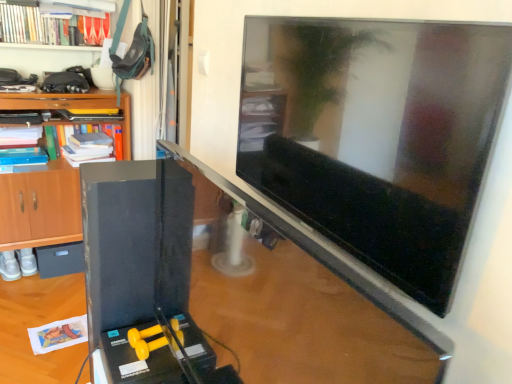
Identify the location of black matte drawer at lower left. (60, 259).

What are the coordinates of `matte black tv at upper right` in the screenshot? It's located at (375, 135).

At what (x,y) coordinates should I click in order to perform the action: click on wooden cabinet at left. Please return your answer as a coordinate pair (x, y). Looking at the image, I should click on (37, 214).

Describe the element at coordinates (32, 25) in the screenshot. I see `hardcover book at upper left, acting as the second book starting from the bottom` at that location.

This screenshot has width=512, height=384. Describe the element at coordinates (93, 145) in the screenshot. I see `green matte book at upper left, which is counted as the 2th book, starting from the top` at that location.

Image resolution: width=512 pixels, height=384 pixels. Find the location of `black matte drawer at lower left`. black matte drawer at lower left is located at coordinates (60, 259).

From the picture: How distant is matte black tv at upper right from black matte drawer at lower left?

matte black tv at upper right and black matte drawer at lower left are 2.16 meters apart from each other.

From a real-world perspective, is matte black tv at upper right positioned over black matte drawer at lower left based on gravity?

Correct, in the physical world, matte black tv at upper right is higher than black matte drawer at lower left.

Does matte black tv at upper right turn towards black matte drawer at lower left?

No, matte black tv at upper right is not facing towards black matte drawer at lower left.

Is satin black monitor at center not within green matte book at upper left, which is counted as the 2th book, starting from the top?

That's correct, satin black monitor at center is outside of green matte book at upper left, which is counted as the 2th book, starting from the top.

Considering the relative positions of satin black monitor at center and green matte book at upper left, which is counted as the 2th book, starting from the top, in the image provided, is satin black monitor at center in front of green matte book at upper left, which is counted as the 2th book, starting from the top,?

Yes, it is in front of green matte book at upper left, which is counted as the 2th book, starting from the top.

Where is `computer desk in front of the green matte book at upper left, which is counted as the 2th book, starting from the top`? The width and height of the screenshot is (512, 384). computer desk in front of the green matte book at upper left, which is counted as the 2th book, starting from the top is located at coordinates (233, 291).

Does point (219, 324) come closer to viewer compared to point (78, 149)?

Yes, it is in front of point (78, 149).

Are matte black tv at upper right and green matte book at upper left, which is counted as the 2th book, starting from the top, located far from each other?

Yes.

Find the location of `the 2nd book behind the matte black tv at upper right`. the 2nd book behind the matte black tv at upper right is located at coordinates (93, 145).

How distant is matte black tv at upper right from green matte book at upper left, acting as the 1th book starting from the bottom?

A distance of 1.85 meters exists between matte black tv at upper right and green matte book at upper left, acting as the 1th book starting from the bottom.

Based on their positions, is matte black tv at upper right located to the left or right of green matte book at upper left, acting as the 1th book starting from the bottom?

matte black tv at upper right is positioned on green matte book at upper left, acting as the 1th book starting from the bottom,'s right side.

Considering the positions of objects hardcover book at upper left, placed as the 1th book when sorted from top to bottom, and wooden cabinet at left in the image provided, who is more to the left, hardcover book at upper left, placed as the 1th book when sorted from top to bottom, or wooden cabinet at left?

From the viewer's perspective, wooden cabinet at left appears more on the left side.

Is hardcover book at upper left, placed as the 1th book when sorted from top to bottom, completely or partially outside of wooden cabinet at left?

Indeed, hardcover book at upper left, placed as the 1th book when sorted from top to bottom, is completely outside wooden cabinet at left.

Is hardcover book at upper left, acting as the second book starting from the bottom, taller than wooden cabinet at left?

No, hardcover book at upper left, acting as the second book starting from the bottom, is not taller than wooden cabinet at left.

Which of these two, hardcover book at upper left, acting as the second book starting from the bottom, or wooden cabinet at left, is thinner?

Thinner between the two is hardcover book at upper left, acting as the second book starting from the bottom.

Is black matte drawer at lower left not close to matte black tv at upper right?

Yes, black matte drawer at lower left and matte black tv at upper right are quite far apart.

What's the angular difference between black matte drawer at lower left and matte black tv at upper right's facing directions?

91.2 degrees separate the facing orientations of black matte drawer at lower left and matte black tv at upper right.

You are a GUI agent. You are given a task and a screenshot of the screen. Output one action in this format:
    pyautogui.click(x=<x>, y=<y>)
    Task: Click on the drawer located behind the matte black tv at upper right
    The width and height of the screenshot is (512, 384).
    Given the screenshot: What is the action you would take?
    pos(60,259)

From a real-world perspective, between black matte drawer at lower left and matte black tv at upper right, who is vertically higher?

matte black tv at upper right is physically above.

Considering the relative positions of wooden cabinet at left and black matte drawer at lower left in the image provided, is wooden cabinet at left to the left or to the right of black matte drawer at lower left?

wooden cabinet at left is to the right of black matte drawer at lower left.

Between wooden cabinet at left and black matte drawer at lower left, which one has smaller width?

With smaller width is black matte drawer at lower left.

Is wooden cabinet at left in front of or behind black matte drawer at lower left in the image?

Result: wooden cabinet at left is positioned closer to the viewer than black matte drawer at lower left.

You are a GUI agent. You are given a task and a screenshot of the screen. Output one action in this format:
    pyautogui.click(x=<x>, y=<y>)
    Task: Click on the book that is on the right side of hardcover book at upper left, acting as the second book starting from the bottom
    Image resolution: width=512 pixels, height=384 pixels.
    Given the screenshot: What is the action you would take?
    pyautogui.click(x=93, y=145)

What's the angular difference between green matte book at upper left, acting as the 1th book starting from the bottom, and hardcover book at upper left, placed as the 1th book when sorted from top to bottom,'s facing directions?

The angular difference between green matte book at upper left, acting as the 1th book starting from the bottom, and hardcover book at upper left, placed as the 1th book when sorted from top to bottom, is 5.01 degrees.

Choose the correct answer: Is green matte book at upper left, acting as the 1th book starting from the bottom, inside hardcover book at upper left, placed as the 1th book when sorted from top to bottom, or outside it?

green matte book at upper left, acting as the 1th book starting from the bottom, exists outside the volume of hardcover book at upper left, placed as the 1th book when sorted from top to bottom.

Does green matte book at upper left, acting as the 1th book starting from the bottom, appear on the right side of hardcover book at upper left, acting as the second book starting from the bottom?

Indeed, green matte book at upper left, acting as the 1th book starting from the bottom, is positioned on the right side of hardcover book at upper left, acting as the second book starting from the bottom.

Locate an element on the screen. This screenshot has height=384, width=512. drawer located below the matte black tv at upper right (from the image's perspective) is located at coordinates (60, 259).

This screenshot has width=512, height=384. I want to click on the 1st book positioned above the satin black monitor at center (from the image's perspective), so pos(93,145).

Considering their positions, is satin black monitor at center positioned further to hardcover book at upper left, acting as the second book starting from the bottom, than matte black tv at upper right?

matte black tv at upper right lies further to hardcover book at upper left, acting as the second book starting from the bottom, than the other object.

Which object lies nearer to the anchor point black matte drawer at lower left, satin black monitor at center or wooden cabinet at left?

wooden cabinet at left is closer to black matte drawer at lower left.

When comparing their distances from wooden cabinet at left, does satin black monitor at center or green matte book at upper left, which is counted as the 2th book, starting from the top, seem closer?

green matte book at upper left, which is counted as the 2th book, starting from the top, is closer to wooden cabinet at left.

Based on their spatial positions, is hardcover book at upper left, placed as the 1th book when sorted from top to bottom, or wooden cabinet at left closer to satin black monitor at center?

wooden cabinet at left is positioned closer to the anchor satin black monitor at center.

Based on their spatial positions, is wooden cabinet at left or black matte drawer at lower left further from hardcover book at upper left, acting as the second book starting from the bottom?

Based on the image, black matte drawer at lower left appears to be further to hardcover book at upper left, acting as the second book starting from the bottom.

Looking at the image, which one is located closer to wooden cabinet at left, black matte drawer at lower left or matte black tv at upper right?

black matte drawer at lower left is positioned closer to the anchor wooden cabinet at left.

Based on their spatial positions, is hardcover book at upper left, acting as the second book starting from the bottom, or satin black monitor at center further from green matte book at upper left, which is counted as the 2th book, starting from the top?

satin black monitor at center lies further to green matte book at upper left, which is counted as the 2th book, starting from the top, than the other object.

Considering their positions, is wooden cabinet at left positioned further to hardcover book at upper left, placed as the 1th book when sorted from top to bottom, than green matte book at upper left, acting as the 1th book starting from the bottom?

wooden cabinet at left lies further to hardcover book at upper left, placed as the 1th book when sorted from top to bottom, than the other object.

This screenshot has height=384, width=512. I want to click on book that lies between hardcover book at upper left, placed as the 1th book when sorted from top to bottom, and wooden cabinet at left from top to bottom, so click(x=93, y=145).

Image resolution: width=512 pixels, height=384 pixels. Find the location of `shelf between green matte book at upper left, acting as the 1th book starting from the bottom, and black matte drawer at lower left in the up-down direction`. shelf between green matte book at upper left, acting as the 1th book starting from the bottom, and black matte drawer at lower left in the up-down direction is located at coordinates (37, 214).

I want to click on book positioned between matte black tv at upper right and green matte book at upper left, acting as the 1th book starting from the bottom, from near to far, so click(x=32, y=25).

Find the location of a particular element. television positioned between satin black monitor at center and green matte book at upper left, acting as the 1th book starting from the bottom, from near to far is located at coordinates (375, 135).